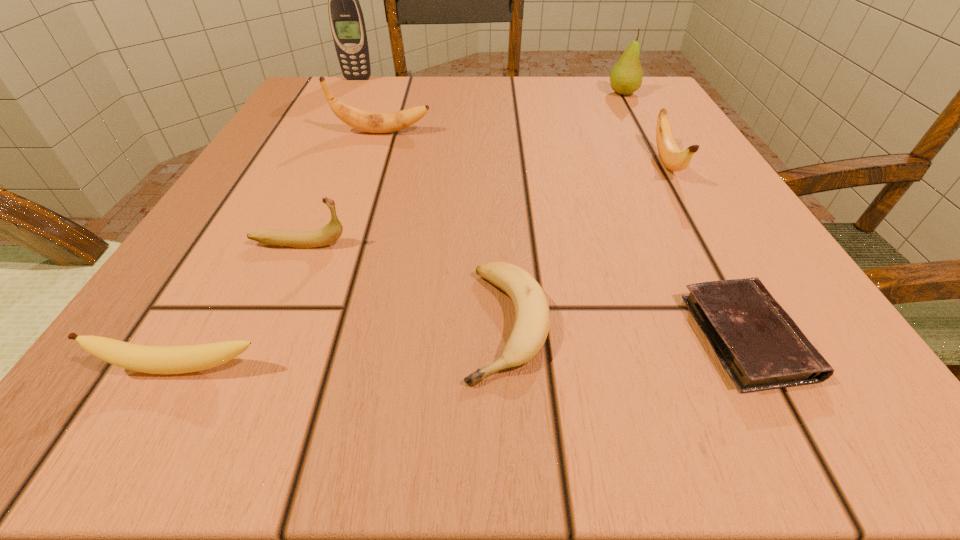
Locate an element on the screen. This screenshot has height=540, width=960. the second shortest object is located at coordinates (532, 322).

This screenshot has height=540, width=960. Find the location of `the fourth object from right to left`. the fourth object from right to left is located at coordinates (532, 322).

Identify the location of diary. (759, 345).

Locate an element on the screen. This screenshot has height=540, width=960. vacant space positioned 0.320m on the screen of the tallest object is located at coordinates (320, 156).

You are a GUI agent. You are given a task and a screenshot of the screen. Output one action in this format:
    pyautogui.click(x=<x>, y=<y>)
    Task: Click on the free space located on the front of the second farthest object
    The image size is (960, 540).
    Given the screenshot: What is the action you would take?
    pyautogui.click(x=685, y=205)

You are a GUI agent. You are given a task and a screenshot of the screen. Output one action in this format:
    pyautogui.click(x=<x>, y=<y>)
    Task: Click on the vacant point located on the peel of the third farthest object from the top
    
    Given the screenshot: What is the action you would take?
    pyautogui.click(x=548, y=132)

Find the location of a particular element. vacant space located 0.200m at the stem of the third farthest banana is located at coordinates (500, 244).

You are a GUI agent. You are given a task and a screenshot of the screen. Output one action in this format:
    pyautogui.click(x=<x>, y=<y>)
    Task: Click on the vacant point located at the stem of the fourth farthest object
    
    Given the screenshot: What is the action you would take?
    pyautogui.click(x=732, y=280)

Locate an element on the screen. Image resolution: width=960 pixels, height=540 pixels. vacant area situated on the left of the fourth banana from left to right is located at coordinates (191, 324).

This screenshot has width=960, height=540. I want to click on free region located 0.250m on the left of the shortest object, so click(461, 338).